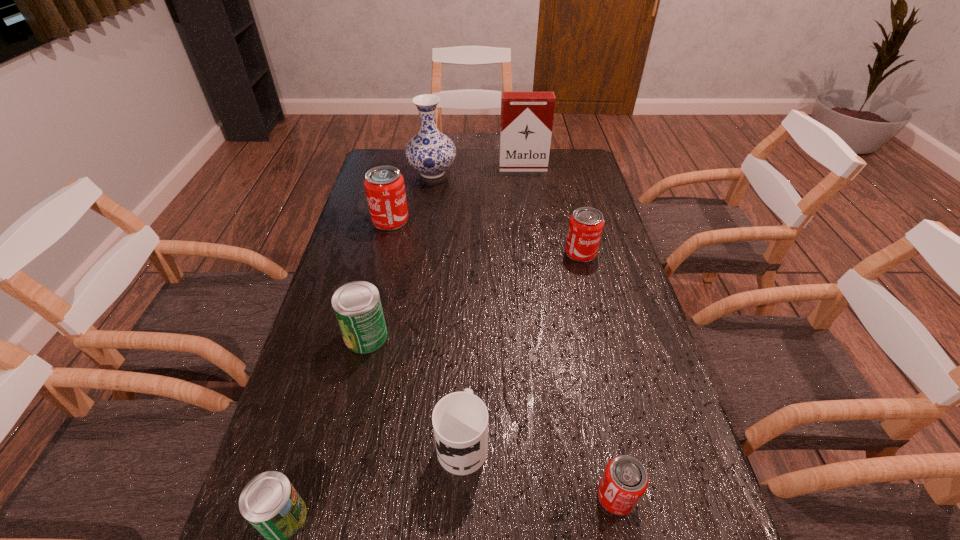
Identify the location of the nearest red can. The image size is (960, 540). (624, 481).

The width and height of the screenshot is (960, 540). I want to click on free space located on the right of the vase, so point(508,173).

Image resolution: width=960 pixels, height=540 pixels. What are the coordinates of `vacant area situated 0.080m on the front-facing side of the red cigarette_case` in the screenshot? It's located at [525, 183].

What are the coordinates of `vacant space located on the front of the farthest can` in the screenshot? It's located at (383, 252).

Locate an element on the screen. free space located 0.090m on the back of the second farthest red can is located at coordinates (574, 226).

Locate an element on the screen. free spot located on the right of the fifth farthest object is located at coordinates (456, 335).

At what (x,y) coordinates should I click in order to perform the action: click on vacant space positioned on the handle side of the mug. Please return your answer as a coordinate pair (x, y). This screenshot has width=960, height=540. Looking at the image, I should click on (464, 390).

Find the location of a particular element. This screenshot has height=540, width=960. free space located on the handle side of the mug is located at coordinates (466, 325).

Find the location of a particular element. free space located 0.080m on the handle side of the mug is located at coordinates (465, 380).

At what (x,y) coordinates should I click in order to perform the action: click on free location located on the right of the smallest red can. Please return your answer as a coordinate pair (x, y). The height and width of the screenshot is (540, 960). Looking at the image, I should click on (661, 496).